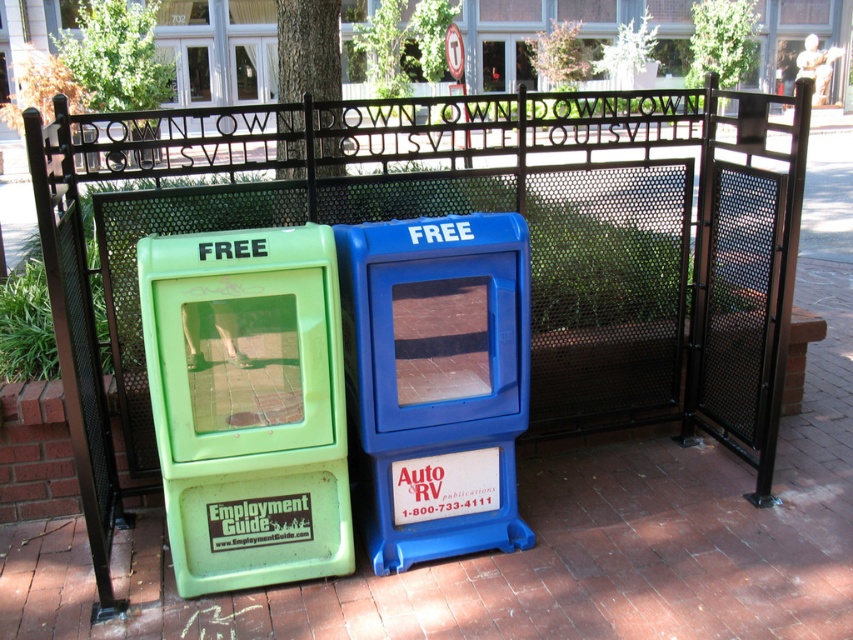
You are a delivery person with a cart that is 16 inches wide. You need to pass between the green plastic employment guide box at left and the blue plastic box at center. Can your cart fit through the space between them?

The green plastic employment guide box at left is 15.31 inches from the blue plastic box at center, so the cart that is 16 inches wide cannot fit through the space between them.

You are standing in front of two newspaper dispensers. The green plastic employment guide box at left and the blue plastic box at center are both on the sidewalk. Which dispenser is closer to the fence behind them?

The blue plastic box at center is closer to the fence because the green plastic employment guide box at left is positioned on the left side of it, meaning the blue plastic box at center is between the green one and the fence.

You are a delivery person who needs to place a new box between the green plastic employment guide box at left and the blue plastic box at center. The new box is 1.2 meters wide. Can the new box fit in the space between them?

The green plastic employment guide box at left is narrower than the blue plastic box at center. However, the description does not provide the exact distance between them, so we cannot determine if the 1.2 meter wide box will fit. Additional measurements are needed.